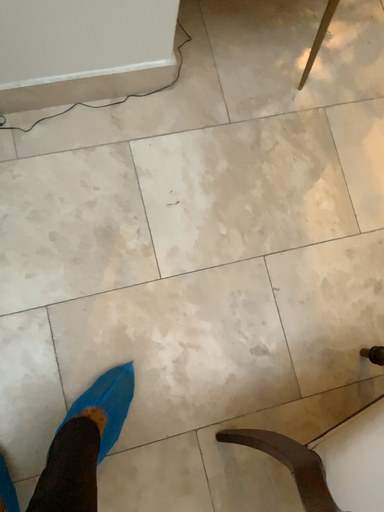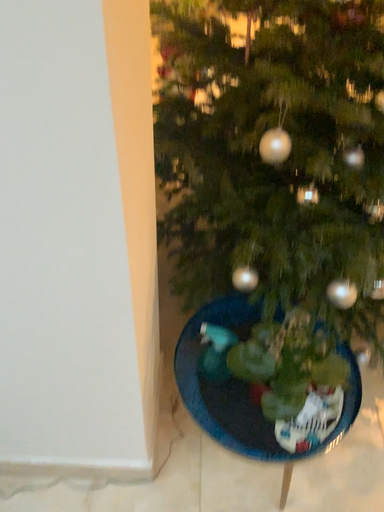
Question: Which way did the camera rotate in the video?

Choices:
 (A) rotated right
 (B) rotated left

Answer: (B)